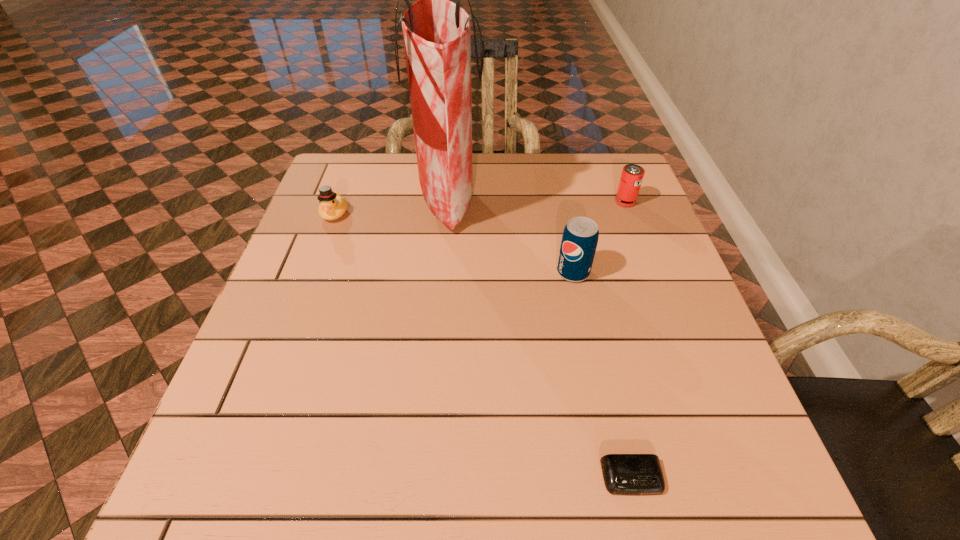
In order to click on free space that is in between the fourth object from right to left and the rightmost object in this screenshot , I will do `click(537, 201)`.

You are a GUI agent. You are given a task and a screenshot of the screen. Output one action in this format:
    pyautogui.click(x=<x>, y=<y>)
    Task: Click on the empty space between the grocery bag and the leftmost object
    
    Given the screenshot: What is the action you would take?
    pyautogui.click(x=391, y=207)

Locate an element on the screen. free space between the pop and the alarm clock is located at coordinates (603, 375).

Where is `free space between the nearest object and the grocery bag`? This screenshot has width=960, height=540. free space between the nearest object and the grocery bag is located at coordinates (540, 339).

Locate an element on the screen. empty location between the fourth tallest object and the shortest object is located at coordinates (484, 345).

The width and height of the screenshot is (960, 540). I want to click on empty location between the alarm clock and the leftmost object, so click(x=484, y=345).

This screenshot has width=960, height=540. I want to click on free space that is in between the can and the duck, so click(x=480, y=207).

Identify the location of free space between the alarm clock and the fourth farthest object. (603, 375).

This screenshot has width=960, height=540. In order to click on free space between the duck and the shortest object in this screenshot , I will do `click(484, 345)`.

Where is `free space between the can and the duck`? free space between the can and the duck is located at coordinates (480, 207).